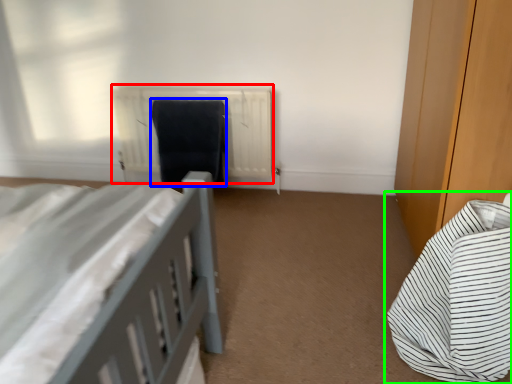
Question: Estimate the real-world distances between objects in this image. Which object is farther from radiator (highlighted by a red box), laundry (highlighted by a blue box) or bed (highlighted by a green box)?

Choices:
 (A) laundry
 (B) bed

Answer: (B)